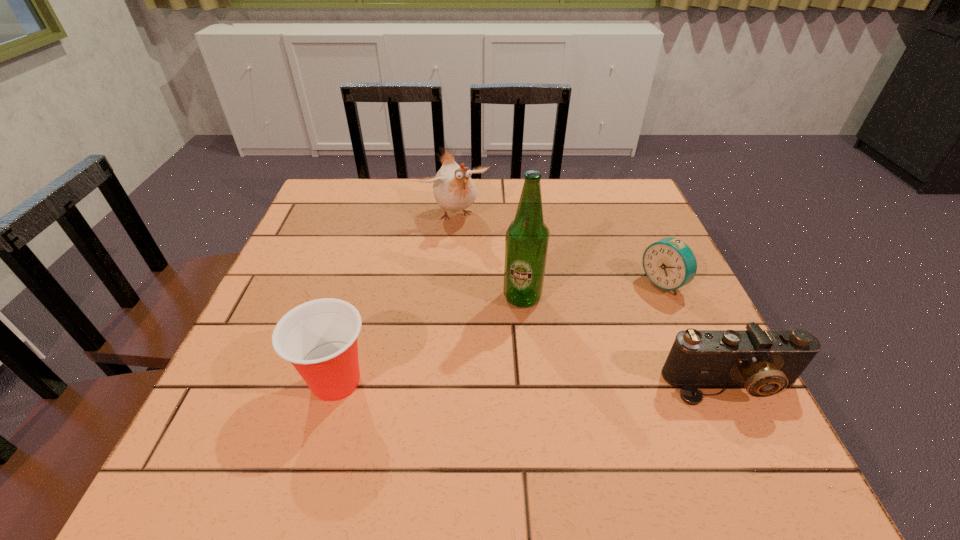
Where is `vacant space on the desktop that is between the leftmost object and the camera and is positioned at the beak of the bird`? vacant space on the desktop that is between the leftmost object and the camera and is positioned at the beak of the bird is located at coordinates (558, 383).

Where is `free space on the desktop that is between the leftmost object and the camera and is positioned on the front-facing side of the alarm clock`? The width and height of the screenshot is (960, 540). free space on the desktop that is between the leftmost object and the camera and is positioned on the front-facing side of the alarm clock is located at coordinates (499, 382).

The height and width of the screenshot is (540, 960). Find the location of `free space on the desktop that is between the cup and the camera and is positioned on the label of the tallest object`. free space on the desktop that is between the cup and the camera and is positioned on the label of the tallest object is located at coordinates (569, 383).